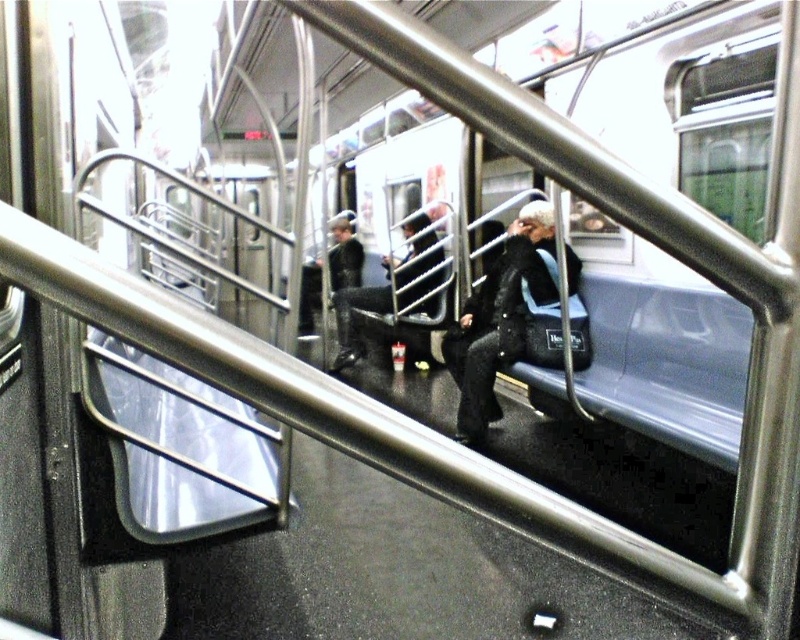
Can you confirm if sparkly black coat at center is positioned to the left of black leather jacket at center?

No, sparkly black coat at center is not to the left of black leather jacket at center.

Is sparkly black coat at center bigger than black leather jacket at center?

Actually, sparkly black coat at center might be smaller than black leather jacket at center.

Is point (466, 426) farther from camera compared to point (418, 348)?

No, it is in front of (418, 348).

At what (x,y) coordinates should I click in order to perform the action: click on sparkly black coat at center. Please return your answer as a coordinate pair (x, y). Looking at the image, I should click on (500, 317).